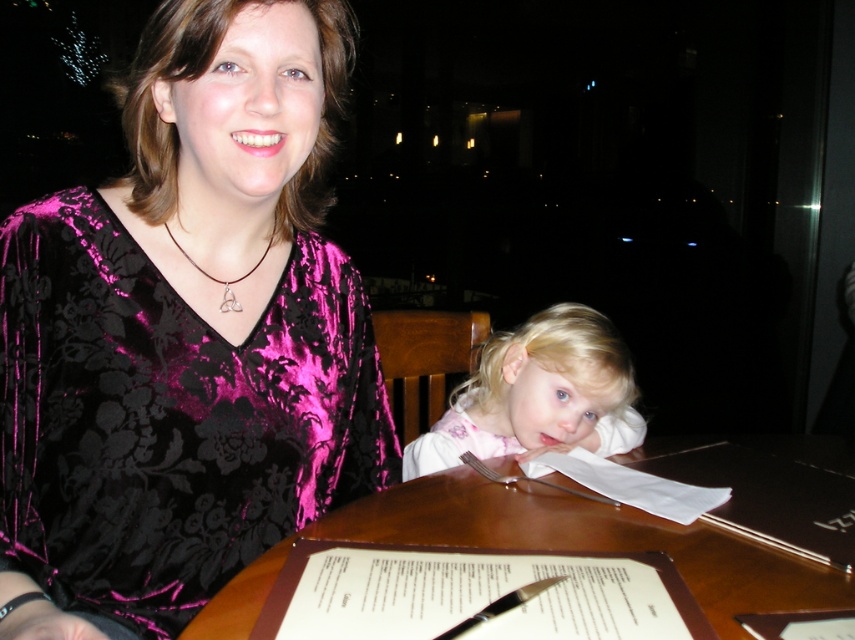
You are a photographer trying to capture a candid shot of the scene. You notice the wooden table at center and the gold metallic pendant at center. Which object is closer to the camera?

The wooden table at center is closer to the camera than the gold metallic pendant at center because it is positioned in front of it.

You are a photographer setting up for a family portrait. You need to ensure that the wooden table at center and the gold metallic pendant at center are both visible in the frame. Based on their heights, which object should be placed closer to the camera to ensure both are fully visible?

The wooden table at center is shorter than the gold metallic pendant at center. To ensure both are fully visible, the wooden table at center should be placed closer to the camera so its shorter height doesn not get obscured by the taller pendant.